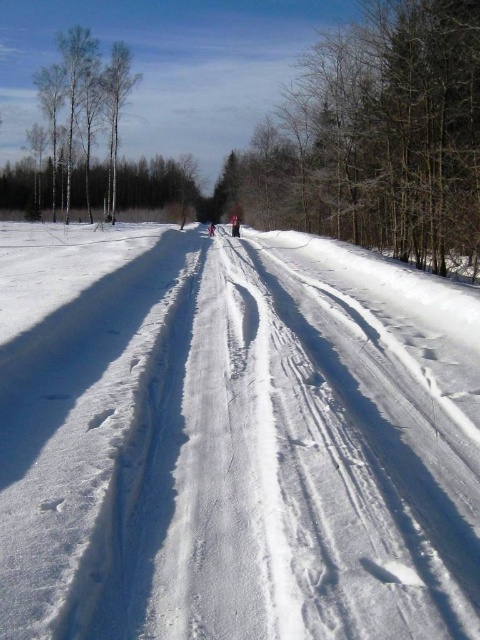
You are standing on the snow path and see the white bark trees at left and the red woolen hat at center. Which object is closer to your left side?

The white bark trees at left are closer to your left side because they are positioned to the left of the red woolen hat at center.

Based on the photo, you are a hiker navigating a snowy trail and see the white bark trees at left and the red woolen hat at center. Which object is closer to you?

The white bark trees at left are closer to you because the red woolen hat at center is behind them.